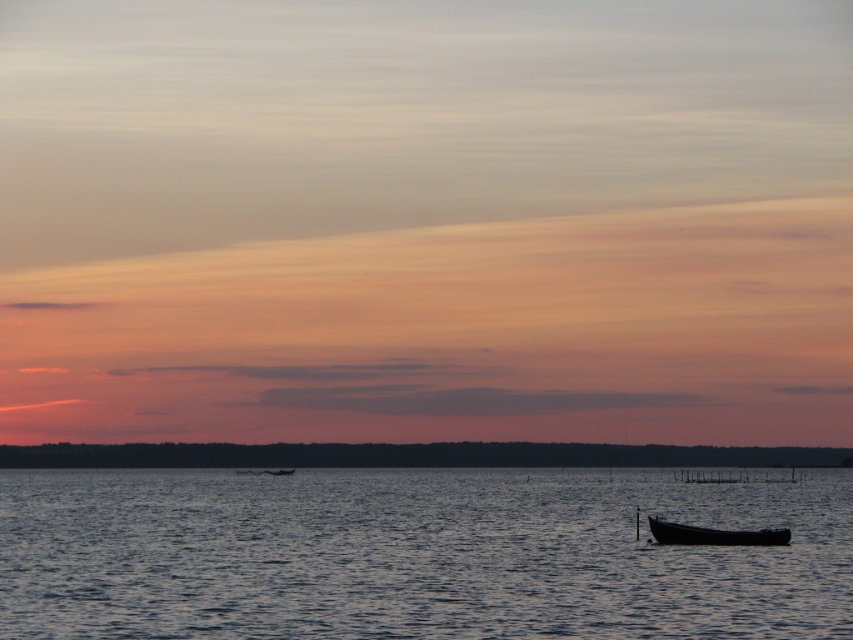
Question: Which point is farther from the camera taking this photo?

Choices:
 (A) (781, 544)
 (B) (250, 461)

Answer: (B)

Question: Can you confirm if black matte canoe at lower right is smaller than smooth black boat at center?

Choices:
 (A) yes
 (B) no

Answer: (A)

Question: Which of the following is the farthest from the observer?

Choices:
 (A) (653, 531)
 (B) (222, 448)
 (C) (469, 616)

Answer: (B)

Question: Which point is closer to the camera taking this photo?

Choices:
 (A) (328, 467)
 (B) (282, 474)

Answer: (B)

Question: Does black matte canoe at lower right have a smaller size compared to smooth black boat at center?

Choices:
 (A) no
 (B) yes

Answer: (B)

Question: From the image, what is the correct spatial relationship of dark blue water at lower center in relation to smooth black boat at center?

Choices:
 (A) left
 (B) right

Answer: (B)